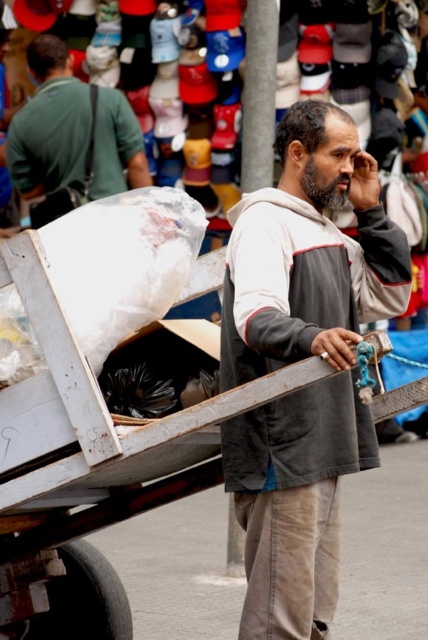
Is gray cotton hoodie at center to the right of matte green shirt at upper left from the viewer's perspective?

Yes, gray cotton hoodie at center is to the right of matte green shirt at upper left.

Describe the element at coordinates (302, 358) in the screenshot. This screenshot has height=640, width=428. I see `gray cotton hoodie at center` at that location.

This screenshot has height=640, width=428. Find the location of `gray cotton hoodie at center`. gray cotton hoodie at center is located at coordinates pyautogui.click(x=302, y=358).